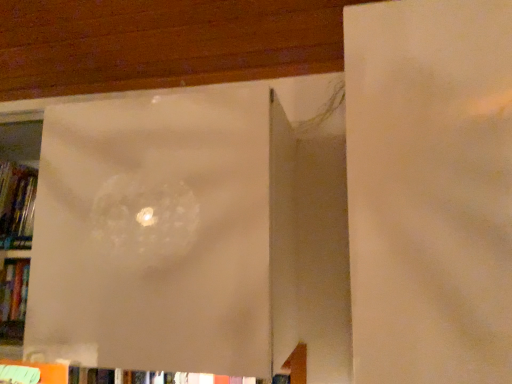
Image resolution: width=512 pixels, height=384 pixels. What do you see at coordinates (194, 231) in the screenshot?
I see `transparent plastic bag at center` at bounding box center [194, 231].

The image size is (512, 384). I want to click on transparent plastic bag at center, so click(x=194, y=231).

The width and height of the screenshot is (512, 384). What do you see at coordinates (16, 203) in the screenshot? I see `hardcover book at left` at bounding box center [16, 203].

Locate an element on the screen. This screenshot has height=384, width=512. hardcover book at left is located at coordinates (16, 203).

This screenshot has height=384, width=512. Find the location of `transparent plastic bag at center`. transparent plastic bag at center is located at coordinates (194, 231).

Does transparent plastic bag at center appear on the right side of hardcover book at left?

Indeed, transparent plastic bag at center is positioned on the right side of hardcover book at left.

Does transparent plastic bag at center lie in front of hardcover book at left?

Yes, it is in front of hardcover book at left.

Between point (319, 174) and point (10, 232), which one is positioned in front?

Point (319, 174)

From the image's perspective, which one is positioned higher, transparent plastic bag at center or hardcover book at left?

hardcover book at left is shown above in the image.

From a real-world perspective, between transparent plastic bag at center and hardcover book at left, who is vertically higher?

hardcover book at left is physically above.

Between transparent plastic bag at center and hardcover book at left, which one has larger width?

transparent plastic bag at center is wider.

Which of these two, transparent plastic bag at center or hardcover book at left, stands taller?

transparent plastic bag at center.

Does transparent plastic bag at center have a smaller size compared to hardcover book at left?

No.

Is transparent plastic bag at center spatially inside hardcover book at left, or outside of it?

transparent plastic bag at center cannot be found inside hardcover book at left.

Are transparent plastic bag at center and hardcover book at left beside each other?

No, transparent plastic bag at center is not making contact with hardcover book at left.

Is hardcover book at left at the back of transparent plastic bag at center?

Correct, transparent plastic bag at center is looking away from hardcover book at left.

What are the coordinates of `book located above the transparent plastic bag at center (from the image's perspective)` in the screenshot? It's located at (16, 203).

Considering the relative positions of hardcover book at left and transparent plastic bag at center in the image provided, is hardcover book at left to the right of transparent plastic bag at center from the viewer's perspective?

Incorrect, hardcover book at left is not on the right side of transparent plastic bag at center.

Is hardcover book at left in front of or behind transparent plastic bag at center in the image?

hardcover book at left is behind transparent plastic bag at center.

Considering the points (30, 230) and (164, 290), which point is in front, point (30, 230) or point (164, 290)?

Point (164, 290)

From the image's perspective, is hardcover book at left located beneath transparent plastic bag at center?

No, from the image's perspective, hardcover book at left is not beneath transparent plastic bag at center.

From a real-world perspective, is hardcover book at left beneath transparent plastic bag at center?

No, from a real-world perspective, hardcover book at left is not under transparent plastic bag at center.

Which object is wider, hardcover book at left or transparent plastic bag at center?

Wider between the two is transparent plastic bag at center.

Who is shorter, hardcover book at left or transparent plastic bag at center?

With less height is hardcover book at left.

Consider the image. Considering the relative sizes of hardcover book at left and transparent plastic bag at center in the image provided, is hardcover book at left smaller than transparent plastic bag at center?

Yes, hardcover book at left is smaller than transparent plastic bag at center.

Is transparent plastic bag at center located within hardcover book at left?

That's incorrect, transparent plastic bag at center is not inside hardcover book at left.

Is hardcover book at left touching transparent plastic bag at center?

No, hardcover book at left is not next to transparent plastic bag at center.

Is hardcover book at left aimed at transparent plastic bag at center?

Yes, hardcover book at left is facing transparent plastic bag at center.

How different are the orientations of hardcover book at left and transparent plastic bag at center in degrees?

The facing directions of hardcover book at left and transparent plastic bag at center are 0.0864 degrees apart.

Measure the distance from hardcover book at left to transparent plastic bag at center.

hardcover book at left is 5.35 feet from transparent plastic bag at center.

In the image, there is a transparent plastic bag at center. In order to click on book above it (from the image's perspective) in this screenshot , I will do `click(16, 203)`.

This screenshot has height=384, width=512. Find the location of `window frame located on the right of hardcover book at left`. window frame located on the right of hardcover book at left is located at coordinates (194, 231).

The height and width of the screenshot is (384, 512). I want to click on window frame below the hardcover book at left (from a real-world perspective), so click(x=194, y=231).